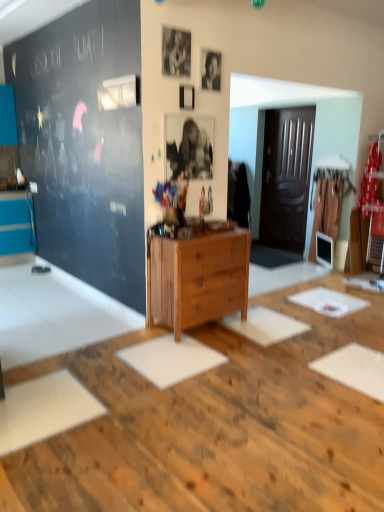
What do you see at coordinates (197, 278) in the screenshot?
I see `wooden chest of drawers at center` at bounding box center [197, 278].

The height and width of the screenshot is (512, 384). Identify the location of wooden chest of drawers at center. (197, 278).

Find the location of a particular element. The image size is (384, 512). white matte table at center is located at coordinates (216, 426).

Describe the element at coordinates (216, 426) in the screenshot. I see `white matte table at center` at that location.

Identify the location of wooden chest of drawers at center. (197, 278).

Which object is positioned more to the left, wooden chest of drawers at center or white matte table at center?

From the viewer's perspective, white matte table at center appears more on the left side.

In the image, is wooden chest of drawers at center positioned in front of or behind white matte table at center?

wooden chest of drawers at center is behind white matte table at center.

Is point (209, 303) closer to viewer compared to point (173, 501)?

That is False.

From the picture: From the image's perspective, between wooden chest of drawers at center and white matte table at center, who is located below?

white matte table at center appears lower in the image.

In the scene shown: From a real-world perspective, between wooden chest of drawers at center and white matte table at center, who is vertically higher?

From a 3D spatial view, wooden chest of drawers at center is above.

Does wooden chest of drawers at center have a lesser width compared to white matte table at center?

Indeed, wooden chest of drawers at center has a lesser width compared to white matte table at center.

Is wooden chest of drawers at center taller than white matte table at center?

Correct, wooden chest of drawers at center is much taller as white matte table at center.

Who is smaller, wooden chest of drawers at center or white matte table at center?

wooden chest of drawers at center.

Can white matte table at center be found inside wooden chest of drawers at center?

No.

Are wooden chest of drawers at center and white matte table at center located far from each other?

That's not correct — wooden chest of drawers at center is a little close to white matte table at center.

Could you tell me if wooden chest of drawers at center is turned towards white matte table at center?

No, wooden chest of drawers at center is not oriented towards white matte table at center.

What's the angular difference between wooden chest of drawers at center and white matte table at center's facing directions?

The angle between the facing direction of wooden chest of drawers at center and the facing direction of white matte table at center is 90.3 degrees.

Image resolution: width=384 pixels, height=512 pixels. In the image, there is a wooden chest of drawers at center. Identify the location of table below it (from the image's perspective). (216, 426).

Considering the positions of objects white matte table at center and wooden chest of drawers at center in the image provided, who is more to the left, white matte table at center or wooden chest of drawers at center?

Positioned to the left is white matte table at center.

Is white matte table at center closer to the viewer compared to wooden chest of drawers at center?

That is True.

Between point (123, 424) and point (202, 239), which one is positioned behind?

Positioned behind is point (202, 239).

From the image's perspective, would you say white matte table at center is shown under wooden chest of drawers at center?

Indeed, from the image's perspective, white matte table at center is shown beneath wooden chest of drawers at center.

From a real-world perspective, which object rests below the other?

white matte table at center is physically lower.

Consider the image. Which of these two, white matte table at center or wooden chest of drawers at center, is thinner?

Thinner between the two is wooden chest of drawers at center.

Considering the sizes of objects white matte table at center and wooden chest of drawers at center in the image provided, who is taller, white matte table at center or wooden chest of drawers at center?

wooden chest of drawers at center.

Considering the sizes of objects white matte table at center and wooden chest of drawers at center in the image provided, who is bigger, white matte table at center or wooden chest of drawers at center?

Bigger between the two is white matte table at center.

Is wooden chest of drawers at center completely or partially inside white matte table at center?

No, wooden chest of drawers at center is not a part of white matte table at center.

Are white matte table at center and wooden chest of drawers at center making contact?

There is a gap between white matte table at center and wooden chest of drawers at center.

Could you tell me if white matte table at center is facing wooden chest of drawers at center?

No.

Locate an element on the screen. chest of drawers behind the white matte table at center is located at coordinates (197, 278).

This screenshot has width=384, height=512. In order to click on the chest of drawers behind the white matte table at center in this screenshot , I will do `click(197, 278)`.

Locate an element on the screen. Image resolution: width=384 pixels, height=512 pixels. chest of drawers above the white matte table at center (from the image's perspective) is located at coordinates (197, 278).